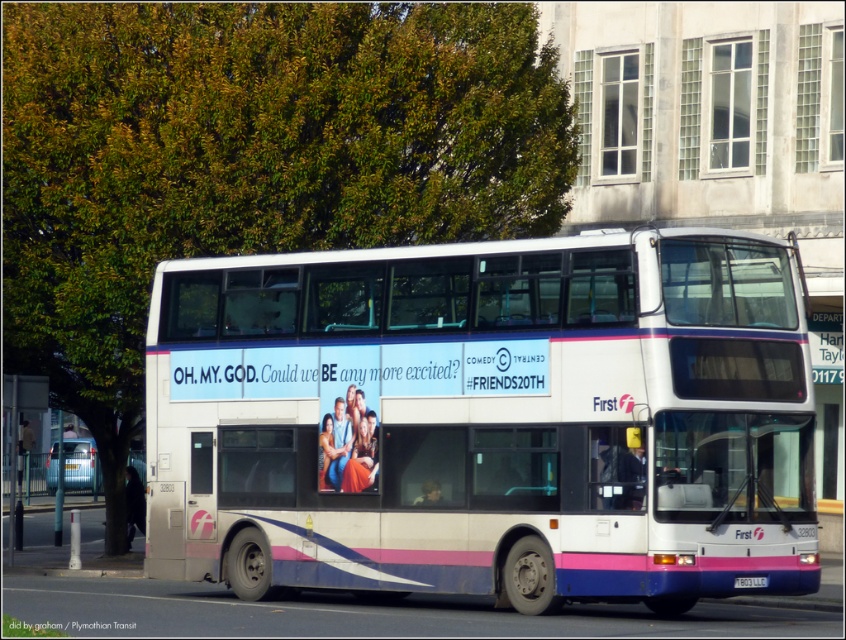
Question: Which object is closer to the camera taking this photo?

Choices:
 (A) white matte/decked bus at center
 (B) white plastic license plate at center

Answer: (A)

Question: Observing the image, what is the correct spatial positioning of white matte/decked bus at center in reference to white plastic license plate at center?

Choices:
 (A) above
 (B) below

Answer: (A)

Question: Does white matte/decked bus at center lie behind white plastic license plate at center?

Choices:
 (A) no
 (B) yes

Answer: (A)

Question: Is white matte/decked bus at center bigger than white plastic license plate at center?

Choices:
 (A) no
 (B) yes

Answer: (B)